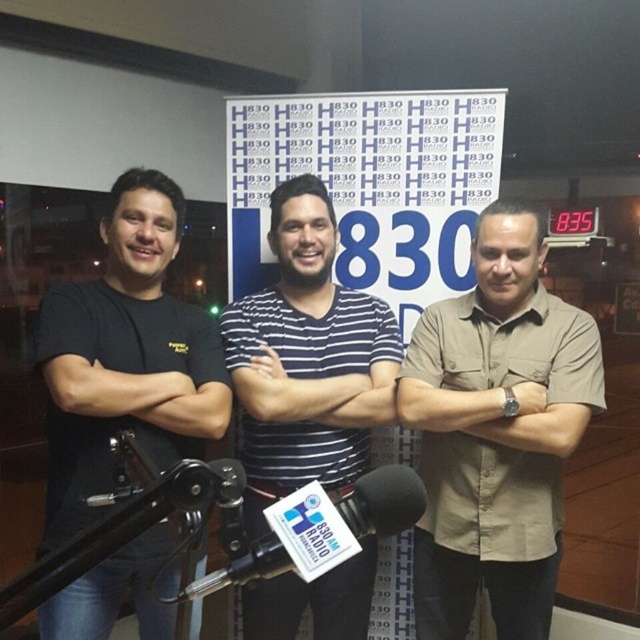
Based on the scene description, where is the beige fabric shirt located? Please provide coordinates in the format of a point like this example format point (452, 378).

The beige fabric shirt at center is located at point (452, 378).

You are a photographer in the studio and need to adjust the lighting to focus on the beige fabric shirt at center and the striped fabric at center. Which one is located to the right of the other?

The beige fabric shirt at center is positioned on the right side of striped fabric at center.